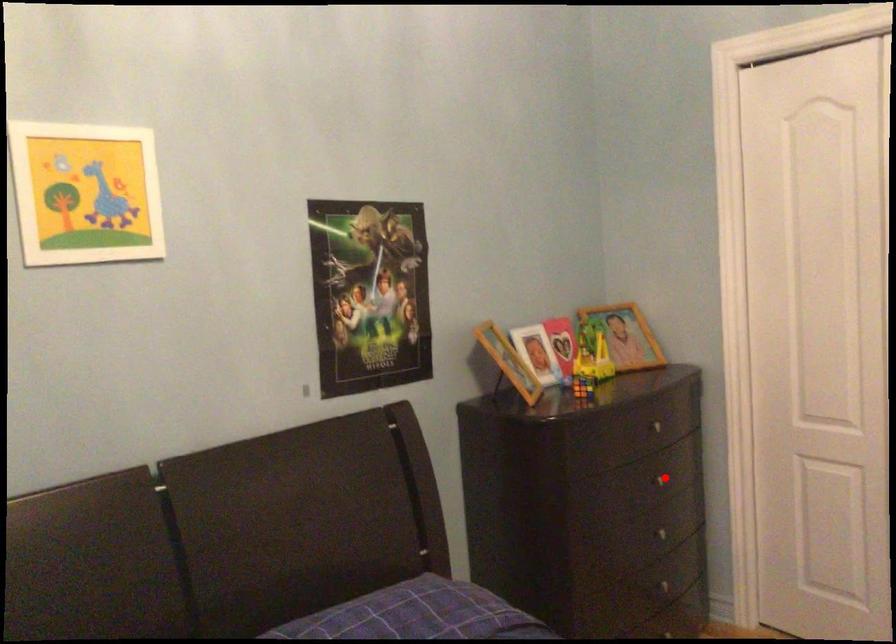
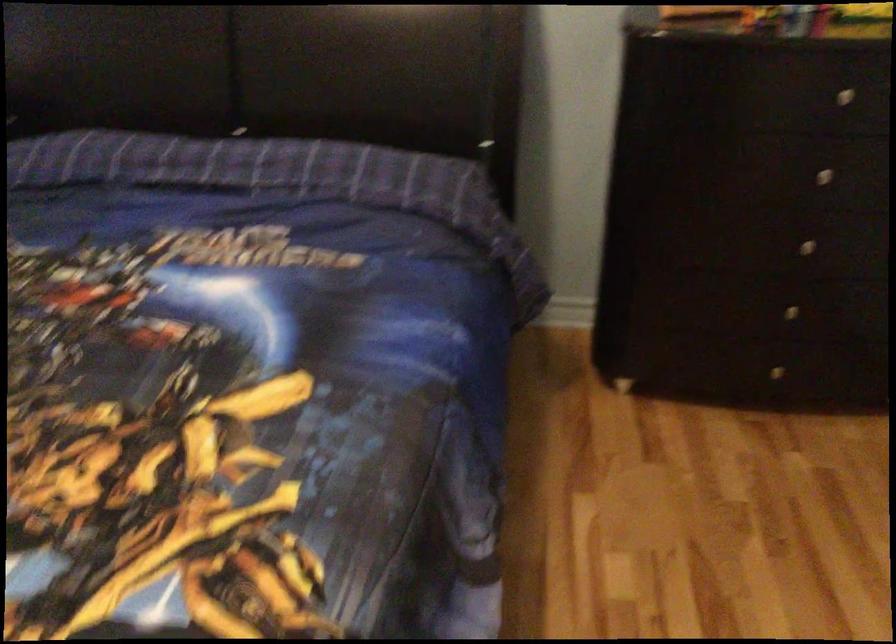
Question: A red point is marked in image1. In image2, is the corresponding 3D point closer to the camera or farther? Reply with the corresponding letter.

Choices:
 (A) The corresponding 3D point is closer.
 (B) The corresponding 3D point is farther.

Answer: (A)